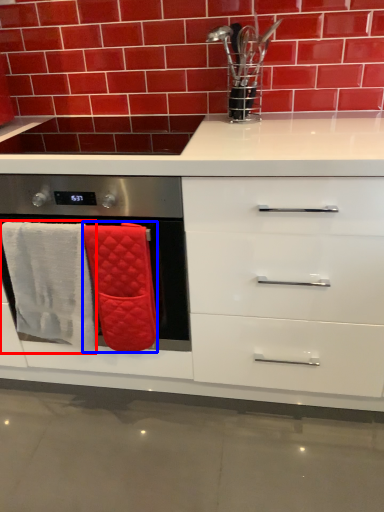
Question: Which point is closer to the camera, bath towel (highlighted by a red box) or bath towel (highlighted by a blue box)?

Choices:
 (A) bath towel
 (B) bath towel

Answer: (B)